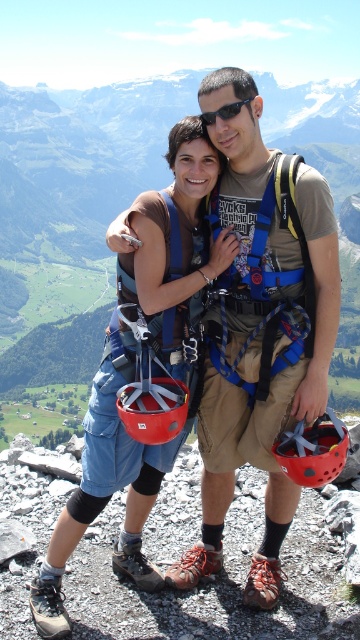
You are a drone operator trying to capture a photo of two climbers on a mountain peak. The climbers are located at point (151,400) and point (219,108). You need to ensure the drone flies directly between them to avoid blocking either climber. Which climber is closer to the drone when it is positioned exactly halfway between them?

The halfway point between point (151,400) and point (219,108) would be equidistant to both climbers, so neither is closer.

You are a photographer trying to capture the climbers in the scene. You notice the matte red helmet at center and the black plastic sunglasses at center. Which object is positioned more to the left in the image?

The matte red helmet at center is positioned to the left of the black plastic sunglasses at center, so the matte red helmet at center is more to the left.